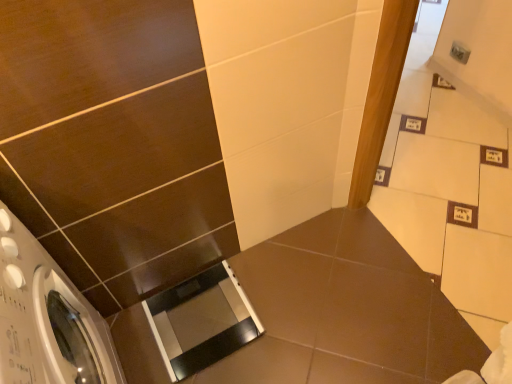
Question: Is white glossy washing machine at lower left bigger than black glossy scale at lower center?

Choices:
 (A) no
 (B) yes

Answer: (B)

Question: Would you say white glossy washing machine at lower left is outside black glossy scale at lower center?

Choices:
 (A) no
 (B) yes

Answer: (B)

Question: From a real-world perspective, is white glossy washing machine at lower left beneath black glossy scale at lower center?

Choices:
 (A) yes
 (B) no

Answer: (B)

Question: Considering the relative sizes of white glossy washing machine at lower left and black glossy scale at lower center in the image provided, is white glossy washing machine at lower left wider than black glossy scale at lower center?

Choices:
 (A) yes
 (B) no

Answer: (B)

Question: Is white glossy washing machine at lower left closer to the viewer compared to black glossy scale at lower center?

Choices:
 (A) yes
 (B) no

Answer: (A)

Question: Considering the positions of transparent plastic screen door at lower center and black glossy scale at lower center in the image, is transparent plastic screen door at lower center wider or thinner than black glossy scale at lower center?

Choices:
 (A) thin
 (B) wide

Answer: (A)

Question: In terms of height, does transparent plastic screen door at lower center look taller or shorter compared to black glossy scale at lower center?

Choices:
 (A) short
 (B) tall

Answer: (A)

Question: Would you say transparent plastic screen door at lower center is inside or outside black glossy scale at lower center?

Choices:
 (A) outside
 (B) inside

Answer: (B)

Question: Is transparent plastic screen door at lower center in front of or behind black glossy scale at lower center in the image?

Choices:
 (A) front
 (B) behind

Answer: (B)

Question: Does point (321, 284) appear closer or farther from the camera than point (250, 334)?

Choices:
 (A) farther
 (B) closer

Answer: (A)

Question: In terms of height, does black glossy scale at lower center look taller or shorter compared to transparent plastic screen door at lower center?

Choices:
 (A) tall
 (B) short

Answer: (A)

Question: Would you say black glossy scale at lower center is inside or outside transparent plastic screen door at lower center?

Choices:
 (A) outside
 (B) inside

Answer: (A)

Question: Looking at their shapes, would you say black glossy scale at lower center is wider or thinner than transparent plastic screen door at lower center?

Choices:
 (A) wide
 (B) thin

Answer: (A)

Question: From a real-world perspective, is white glossy washing machine at lower left above or below transparent plastic screen door at lower center?

Choices:
 (A) above
 (B) below

Answer: (A)

Question: Based on their sizes in the image, would you say white glossy washing machine at lower left is bigger or smaller than transparent plastic screen door at lower center?

Choices:
 (A) big
 (B) small

Answer: (A)